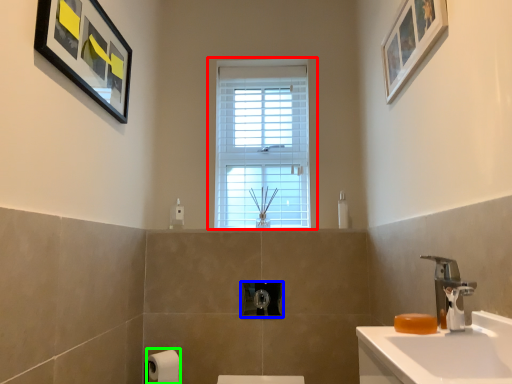
Question: Which is farther away from window (highlighted by a red box)? towel bar (highlighted by a blue box) or toilet paper (highlighted by a green box)?

Choices:
 (A) towel bar
 (B) toilet paper

Answer: (B)